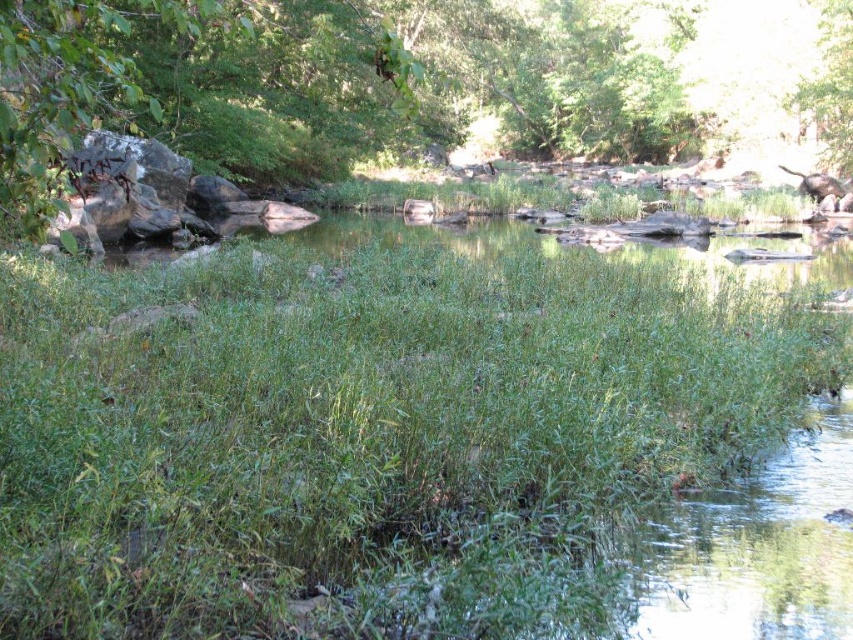
Question: Can you confirm if green leafy grass at center is smaller than green leafy tree at upper right?

Choices:
 (A) no
 (B) yes

Answer: (A)

Question: Can you confirm if green leafy grass at center is positioned to the left of green leafy tree at upper right?

Choices:
 (A) yes
 (B) no

Answer: (A)

Question: Based on their relative distances, which object is nearer to the green leafy tree at upper left?

Choices:
 (A) green leafy tree at upper right
 (B) green leafy grass at center

Answer: (A)

Question: Estimate the real-world distances between objects in this image. Which object is farther from the green leafy grass at center?

Choices:
 (A) green leafy tree at upper left
 (B) green leafy tree at upper right

Answer: (B)

Question: Which point is farther to the camera?

Choices:
 (A) (837, 12)
 (B) (834, 113)

Answer: (B)

Question: Can you confirm if green leafy grass at center is smaller than green leafy tree at upper right?

Choices:
 (A) no
 (B) yes

Answer: (A)